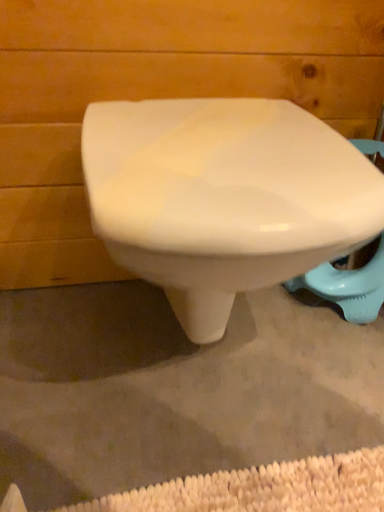
The height and width of the screenshot is (512, 384). What are the coordinates of `white glossy toilet at center` in the screenshot? It's located at (174, 388).

The image size is (384, 512). Describe the element at coordinates (174, 388) in the screenshot. I see `white glossy toilet at center` at that location.

This screenshot has width=384, height=512. Find the location of `white glossy toilet at center`. white glossy toilet at center is located at coordinates pos(174,388).